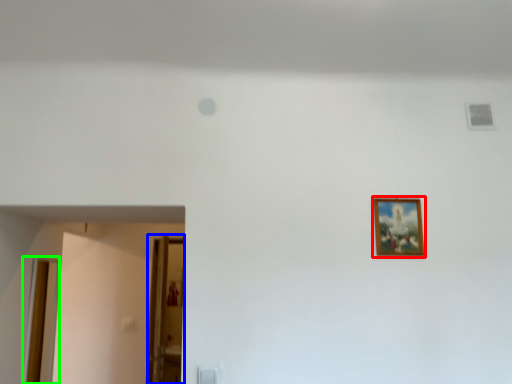
Question: Which object is positioned closest to picture frame (highlighted by a red box)? Select from glass door (highlighted by a blue box) and door (highlighted by a green box).

Choices:
 (A) glass door
 (B) door

Answer: (A)